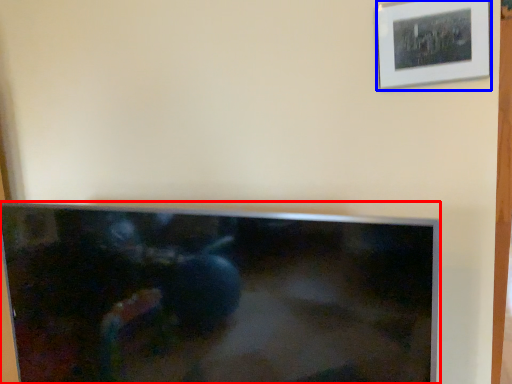
Question: Which object is closer to the camera taking this photo, television (highlighted by a red box) or picture frame (highlighted by a blue box)?

Choices:
 (A) television
 (B) picture frame

Answer: (A)